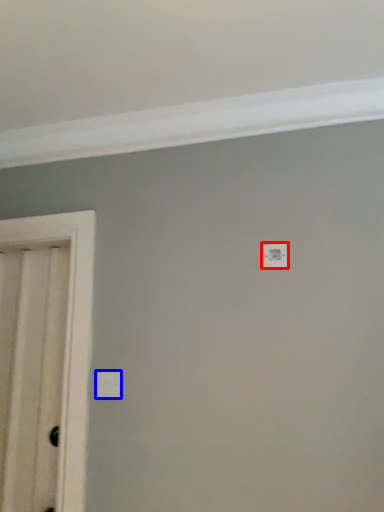
Question: Which point is closer to the camera, light switch (highlighted by a red box) or light switch (highlighted by a blue box)?

Choices:
 (A) light switch
 (B) light switch

Answer: (B)